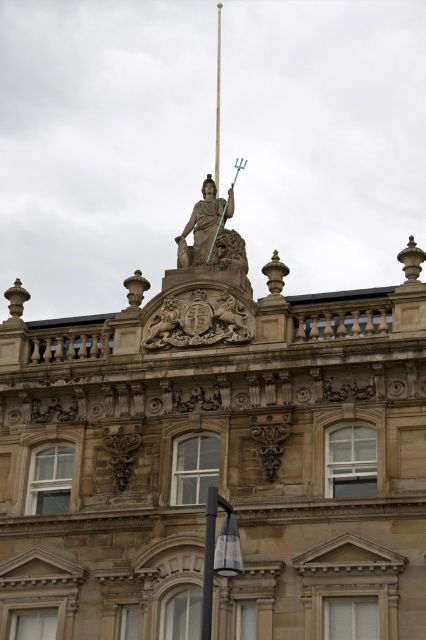
Question: Which object appears closest to the camera in this image?

Choices:
 (A) gold stone coat of arms at center
 (B) green glass pole at upper center
 (C) brown stone statue at upper center

Answer: (C)

Question: Which object appears farthest from the camera in this image?

Choices:
 (A) brown stone statue at upper center
 (B) green glass pole at upper center

Answer: (B)

Question: Can you confirm if brown stone statue at upper center is positioned below gold stone coat of arms at center?

Choices:
 (A) yes
 (B) no

Answer: (A)

Question: Does brown stone statue at upper center have a greater width compared to gold stone coat of arms at center?

Choices:
 (A) no
 (B) yes

Answer: (B)

Question: Which of the following is the closest to the observer?

Choices:
 (A) gold stone coat of arms at center
 (B) brown stone statue at upper center
 (C) green glass pole at upper center

Answer: (B)

Question: Is gold stone coat of arms at center behind green glass pole at upper center?

Choices:
 (A) yes
 (B) no

Answer: (B)